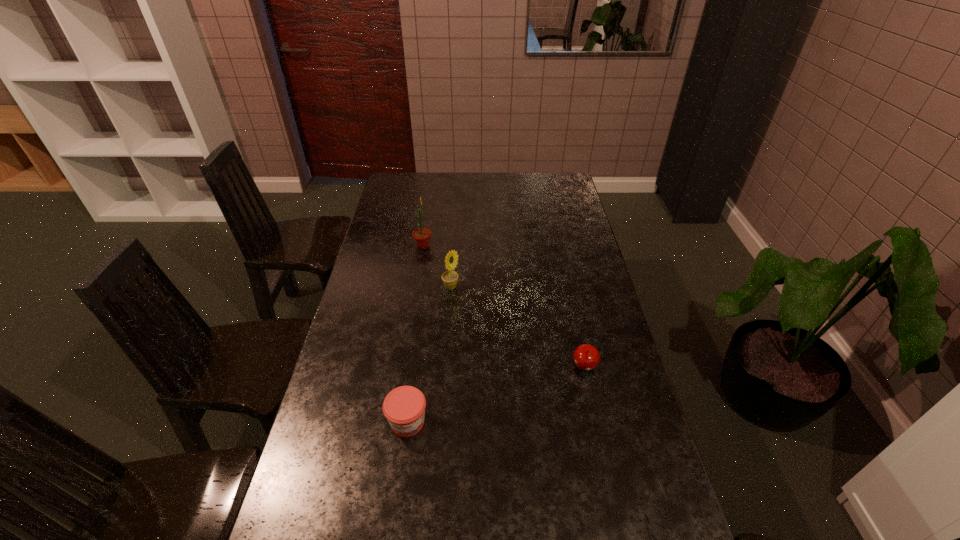
Locate an element on the screen. free space located on the front label of the nearest object is located at coordinates (402, 464).

What are the coordinates of `object at the right edge` in the screenshot? It's located at (586, 357).

The image size is (960, 540). Identify the location of vacant space at the far edge of the desktop. (444, 180).

The image size is (960, 540). I want to click on vacant area at the left edge, so click(x=378, y=274).

Locate an element on the screen. vacant space at the right edge is located at coordinates (594, 467).

This screenshot has height=540, width=960. Identify the location of free space at the far right corner of the desktop. (565, 180).

Locate an element on the screen. This screenshot has height=540, width=960. free space that is in between the jam and the left sunflower is located at coordinates (416, 334).

Locate an element on the screen. This screenshot has width=960, height=540. vacant point located between the cherry and the right sunflower is located at coordinates (517, 328).

At what (x,y) coordinates should I click in order to perform the action: click on vacant point located between the farthest object and the third farthest object. Please return your answer as a coordinate pair (x, y). The height and width of the screenshot is (540, 960). Looking at the image, I should click on (504, 307).

At what (x,y) coordinates should I click in order to perform the action: click on vacant area that lies between the third shortest object and the nearest object. Please return your answer as a coordinate pair (x, y). The image size is (960, 540). Looking at the image, I should click on (429, 355).